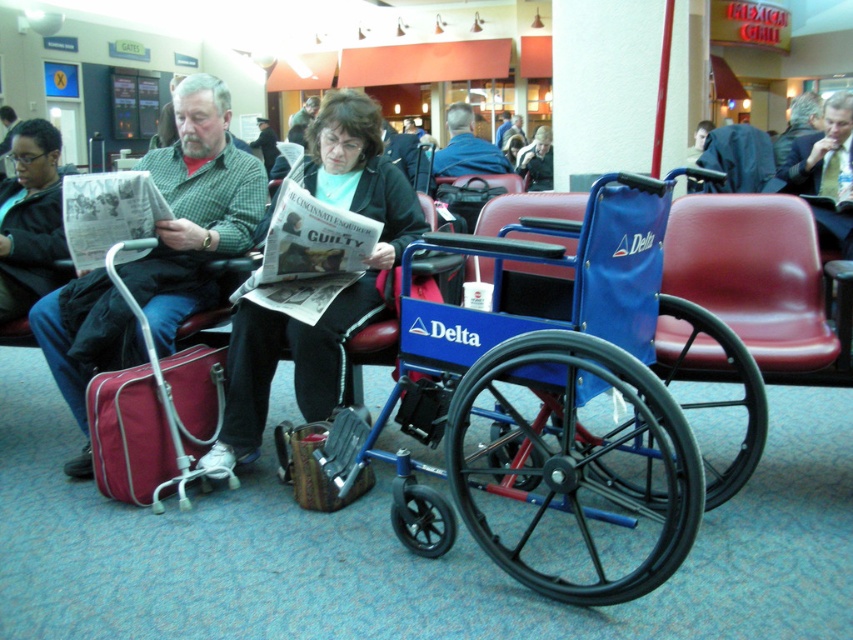
How much distance is there between red leather chair at center and dark gray sweater at center?

They are 7.93 meters apart.

Is point (664, 323) positioned after point (268, 131)?

That is False.

Image resolution: width=853 pixels, height=640 pixels. In order to click on red leather chair at center in this screenshot , I will do `click(753, 275)`.

Is matte black jacket at center bigger than blue fabric jacket at center?

Indeed, matte black jacket at center has a larger size compared to blue fabric jacket at center.

Can you confirm if matte black jacket at center is positioned above blue fabric jacket at center?

Actually, matte black jacket at center is below blue fabric jacket at center.

Is point (292, 355) behind point (459, 166)?

No, (292, 355) is closer to viewer.

The width and height of the screenshot is (853, 640). Find the location of `matte black jacket at center`. matte black jacket at center is located at coordinates (337, 292).

Can you confirm if blue plastic wheelchair at center is positioned above light brown leather jacket at center?

Incorrect, blue plastic wheelchair at center is not positioned above light brown leather jacket at center.

Does blue plastic wheelchair at center have a greater width compared to light brown leather jacket at center?

Indeed, blue plastic wheelchair at center has a greater width compared to light brown leather jacket at center.

The width and height of the screenshot is (853, 640). What do you see at coordinates (548, 413) in the screenshot?
I see `blue plastic wheelchair at center` at bounding box center [548, 413].

Identify the location of blue plastic wheelchair at center. This screenshot has width=853, height=640. (548, 413).